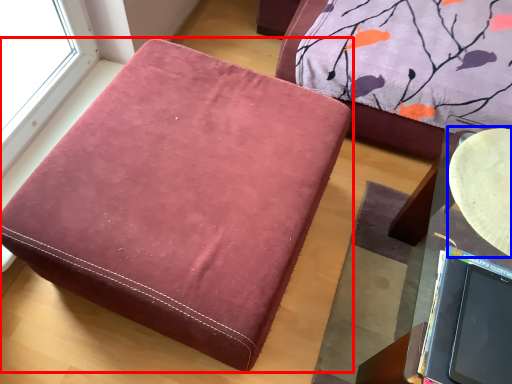
Question: Which object is closer to the camera taking this photo, furniture (highlighted by a red box) or round table (highlighted by a blue box)?

Choices:
 (A) furniture
 (B) round table

Answer: (A)